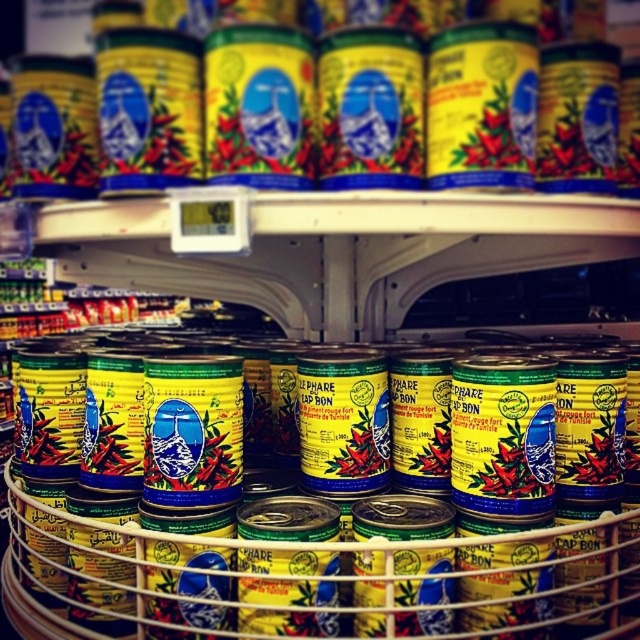
You are a customer looking at the display of chili pepper cans. There are two cans in focus here, the yellow matte can at center and the yellow matte can at upper center. From your perspective, which can is to the right of the other?

The yellow matte can at center is positioned on the right side of the yellow matte can at upper center, so the yellow matte can at center is to the right of the yellow matte can at upper center.

You are a customer trying to choose between two cans of chili peppers. You notice a yellow matte can at center and a yellow matte can at upper center. Which can has a larger width?

The yellow matte can at center has a larger width than the yellow matte can at upper center.